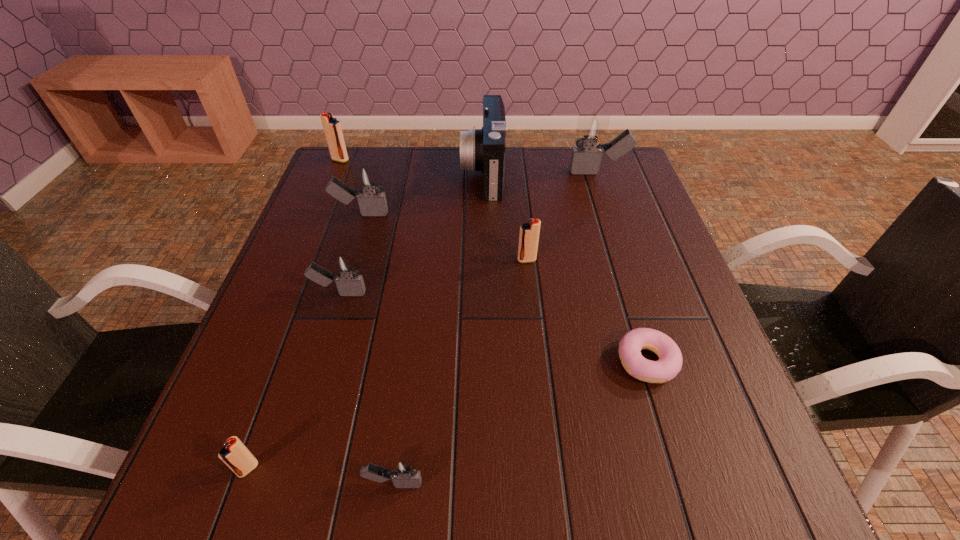
Identify the location of free space located 0.150m on the lens of the camcorder. This screenshot has width=960, height=540. pos(410,172).

You are a GUI agent. You are given a task and a screenshot of the screen. Output one action in this format:
    pyautogui.click(x=<x>, y=<y>)
    Task: Click on the vacant space positioned on the front of the farthest gray igniter
    This screenshot has height=540, width=960.
    Given the screenshot: What is the action you would take?
    pyautogui.click(x=605, y=192)

Locate an element on the screen. The width and height of the screenshot is (960, 540). vacant space located 0.280m on the right of the leftmost object is located at coordinates (441, 160).

You are a GUI agent. You are given a task and a screenshot of the screen. Output one action in this format:
    pyautogui.click(x=<x>, y=<y>)
    Task: Click on the vacant space situated 0.380m on the right of the second farthest gray igniter
    This screenshot has width=960, height=540.
    Given the screenshot: What is the action you would take?
    pyautogui.click(x=533, y=214)

Where is `free space located 0.310m on the front of the sixth farthest object`? The width and height of the screenshot is (960, 540). free space located 0.310m on the front of the sixth farthest object is located at coordinates (294, 447).

The height and width of the screenshot is (540, 960). Identify the location of free space located on the front of the second biggest red igniter. click(540, 381).

This screenshot has width=960, height=540. Find the location of `free space located on the right of the nearest red igniter`. free space located on the right of the nearest red igniter is located at coordinates (407, 469).

I want to click on blank space located on the right of the nearest gray igniter, so click(467, 483).

At what (x,y) coordinates should I click in order to perform the action: click on free location located on the left of the pink doughnut. Please return your answer as a coordinate pair (x, y). Image resolution: width=960 pixels, height=540 pixels. Looking at the image, I should click on (554, 362).

Identify the location of camcorder present at the far edge. 483,149.